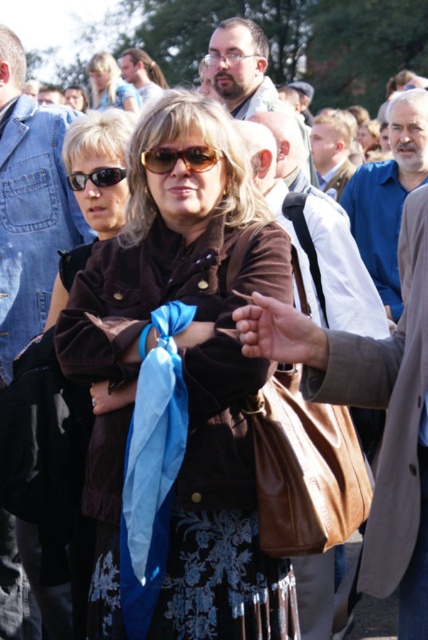
Based on the photo, is matte black glasses at center positioned in front of matte brown jacket at center?

Yes, it is.

Which is behind, point (249, 90) or point (89, 61)?

The point (89, 61) is behind.

I want to click on matte black glasses at center, so click(240, 67).

Does brown leather jacket at center have a greater height compared to matte black glasses at center?

Yes.

Locate an element on the screen. The height and width of the screenshot is (640, 428). brown leather jacket at center is located at coordinates (318, 244).

Which is in front, point (264, 168) or point (222, 74)?

Positioned in front is point (264, 168).

Locate an element on the screen. brown leather jacket at center is located at coordinates (318, 244).

Is brushed denim jacket at left closer to the viewer compared to brown textured sunglasses at center?

No, it is behind brown textured sunglasses at center.

The image size is (428, 640). What do you see at coordinates (29, 205) in the screenshot? I see `brushed denim jacket at left` at bounding box center [29, 205].

What do you see at coordinates (29, 205) in the screenshot?
I see `brushed denim jacket at left` at bounding box center [29, 205].

At what (x,y) coordinates should I click in order to perform the action: click on brushed denim jacket at left. Please return your answer as a coordinate pair (x, y). Looking at the image, I should click on [x=29, y=205].